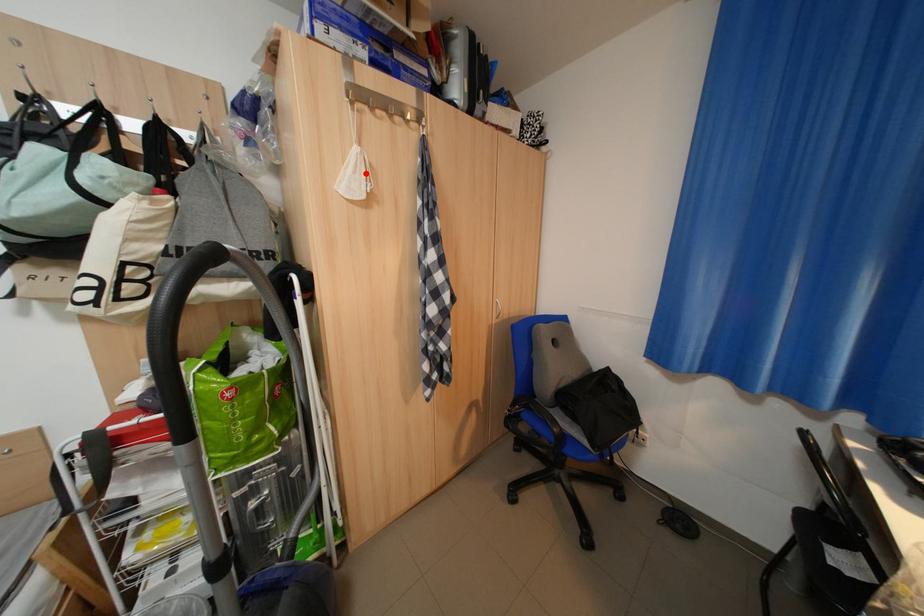
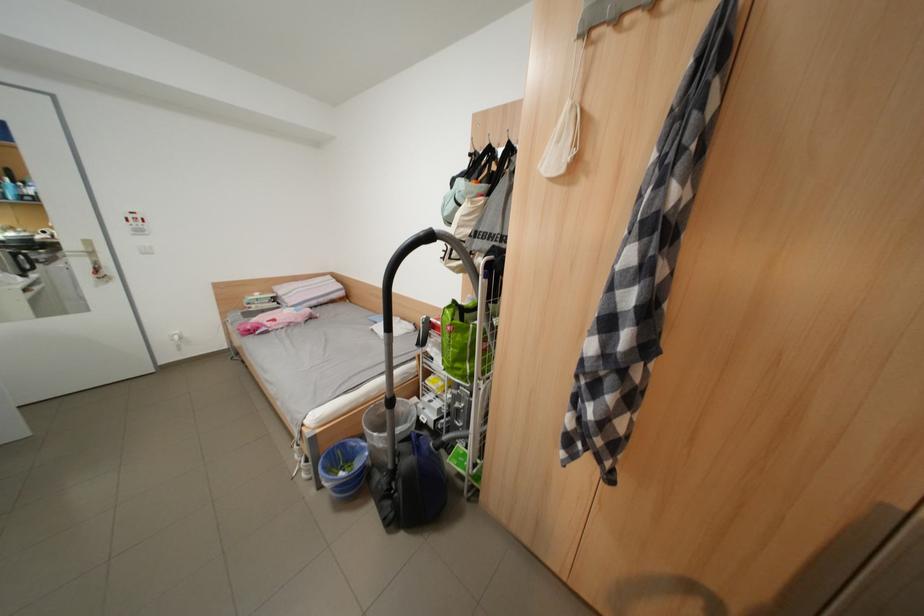
Locate, in the second image, the point that corresponds to the highlighted location in the first image.

(569, 142)